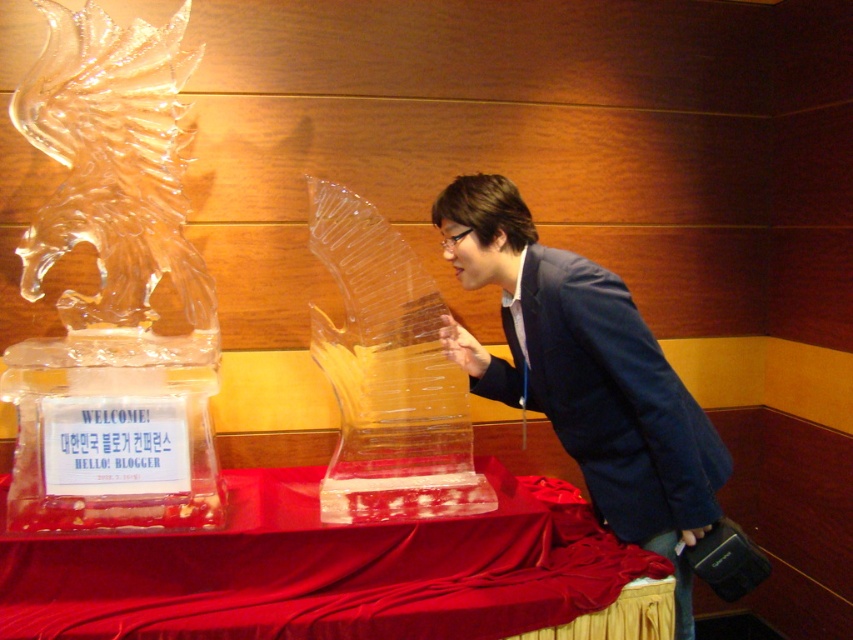
Question: Which object is the farthest from the transparent ice sculpture at center?

Choices:
 (A) blue fabric jacket at center
 (B) clear ice sculpture at left

Answer: (B)

Question: Does smooth red fabric at center appear over blue fabric jacket at center?

Choices:
 (A) no
 (B) yes

Answer: (A)

Question: Which point is closer to the camera taking this photo?

Choices:
 (A) (210, 621)
 (B) (132, 134)
 (C) (413, 378)

Answer: (A)

Question: Among these points, which one is farthest from the camera?

Choices:
 (A) (653, 460)
 (B) (10, 582)
 (C) (412, 426)

Answer: (C)

Question: Considering the relative positions of clear ice sculpture at left and blue fabric jacket at center in the image provided, where is clear ice sculpture at left located with respect to blue fabric jacket at center?

Choices:
 (A) above
 (B) below

Answer: (A)

Question: Does smooth red fabric at center appear on the left side of blue fabric jacket at center?

Choices:
 (A) no
 (B) yes

Answer: (B)